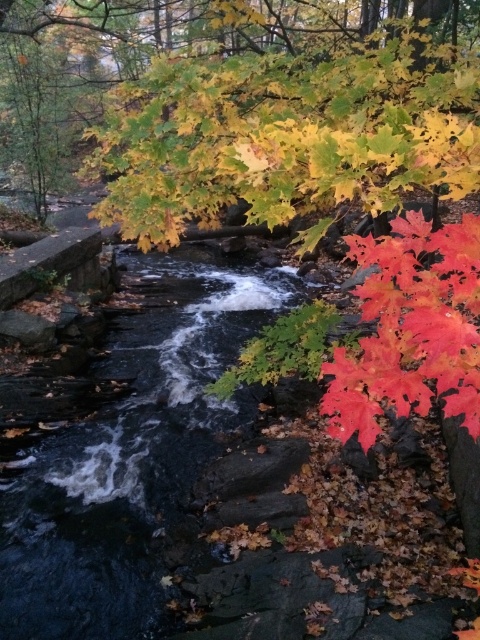
Consider the image. Does dark gray stone stream at center have a lesser height compared to bright red maple leaf at lower right?

In fact, dark gray stone stream at center may be taller than bright red maple leaf at lower right.

Which is more to the right, dark gray stone stream at center or bright red maple leaf at lower right?

From the viewer's perspective, bright red maple leaf at lower right appears more on the right side.

This screenshot has width=480, height=640. What are the coordinates of `dark gray stone stream at center` in the screenshot? It's located at (132, 460).

Is vivid red maple leaf at right above bright red maple leaf at lower right?

Correct, vivid red maple leaf at right is located above bright red maple leaf at lower right.

What do you see at coordinates (411, 328) in the screenshot? The height and width of the screenshot is (640, 480). I see `vivid red maple leaf at right` at bounding box center [411, 328].

Between point (412, 356) and point (373, 440), which one is positioned behind?

The point (412, 356) is behind.

The image size is (480, 640). Find the location of `vivid red maple leaf at right`. vivid red maple leaf at right is located at coordinates (411, 328).

Is dark gray stone stream at center closer to camera compared to vivid red maple leaf at right?

No, dark gray stone stream at center is behind vivid red maple leaf at right.

Is point (204, 316) less distant than point (407, 216)?

No, (204, 316) is further to viewer.

Is point (141, 320) farther from viewer compared to point (432, 342)?

Yes, point (141, 320) is farther from viewer.

At what (x,y) coordinates should I click in order to perform the action: click on dark gray stone stream at center. Please return your answer as a coordinate pair (x, y). Looking at the image, I should click on (132, 460).